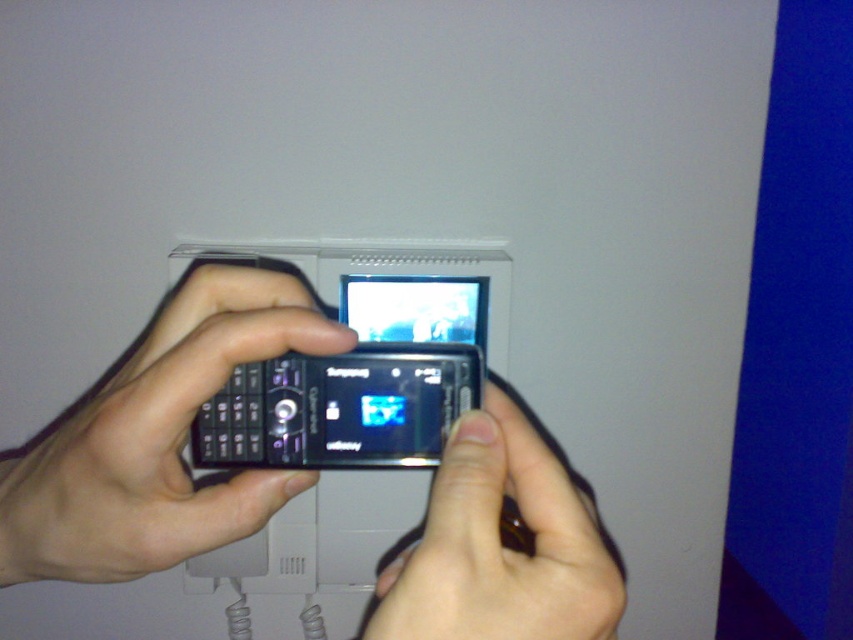
Question: Among these objects, which one is farthest from the camera?

Choices:
 (A) matte black phone at center
 (B) black glossy phone at center

Answer: (B)

Question: Is black glossy phone at center further to camera compared to matte black phone at center?

Choices:
 (A) yes
 (B) no

Answer: (A)

Question: Is black glossy phone at center bigger than matte black phone at center?

Choices:
 (A) no
 (B) yes

Answer: (B)

Question: Which object appears farthest from the camera in this image?

Choices:
 (A) matte black phone at center
 (B) black glossy phone at center

Answer: (B)

Question: Is black glossy phone at center above matte black phone at center?

Choices:
 (A) no
 (B) yes

Answer: (B)